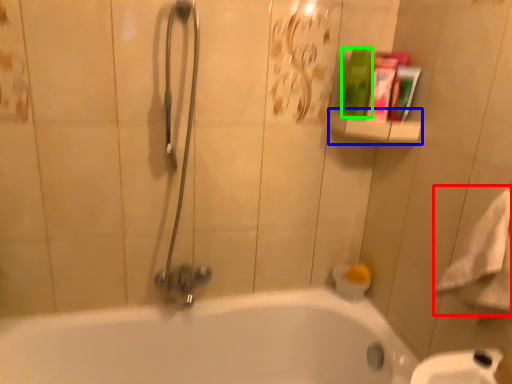
Question: Which object is the closest to the bath towel (highlighted by a red box)? Choose among these: balustrade (highlighted by a blue box) or cleaning product (highlighted by a green box).

Choices:
 (A) balustrade
 (B) cleaning product

Answer: (A)